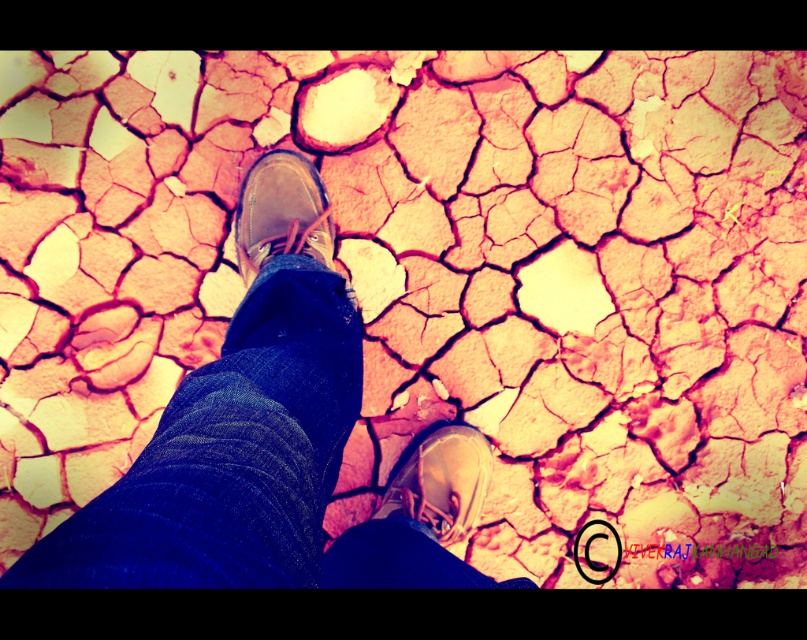
Does point (237, 483) come farther from viewer compared to point (429, 483)?

No, it is in front of (429, 483).

Who is more forward, (x=446, y=492) or (x=433, y=534)?

Point (x=433, y=534) is in front.

Where is `brown leather shoes at center`? Image resolution: width=807 pixels, height=640 pixels. brown leather shoes at center is located at coordinates (270, 442).

Who is positioned more to the right, brown leather shoes at center or brown leather shoe at center?

brown leather shoes at center is more to the right.

Is point (203, 387) closer to camera compared to point (325, 225)?

Yes.

Where is `brown leather shoes at center`? The width and height of the screenshot is (807, 640). brown leather shoes at center is located at coordinates tap(270, 442).

Who is positioned more to the left, brown leather shoe at center or matte brown shoe at center?

Positioned to the left is brown leather shoe at center.

Is brown leather shoe at center above matte brown shoe at center?

Yes, brown leather shoe at center is above matte brown shoe at center.

You are a GUI agent. You are given a task and a screenshot of the screen. Output one action in this format:
    pyautogui.click(x=<x>, y=<y>)
    Task: Click on the brown leather shoe at center
    
    Given the screenshot: What is the action you would take?
    pyautogui.click(x=282, y=212)

You are a GUI agent. You are given a task and a screenshot of the screen. Output one action in this format:
    pyautogui.click(x=<x>, y=<y>)
    Task: Click on the brown leather shoe at center
    The image size is (807, 640).
    Given the screenshot: What is the action you would take?
    pyautogui.click(x=282, y=212)